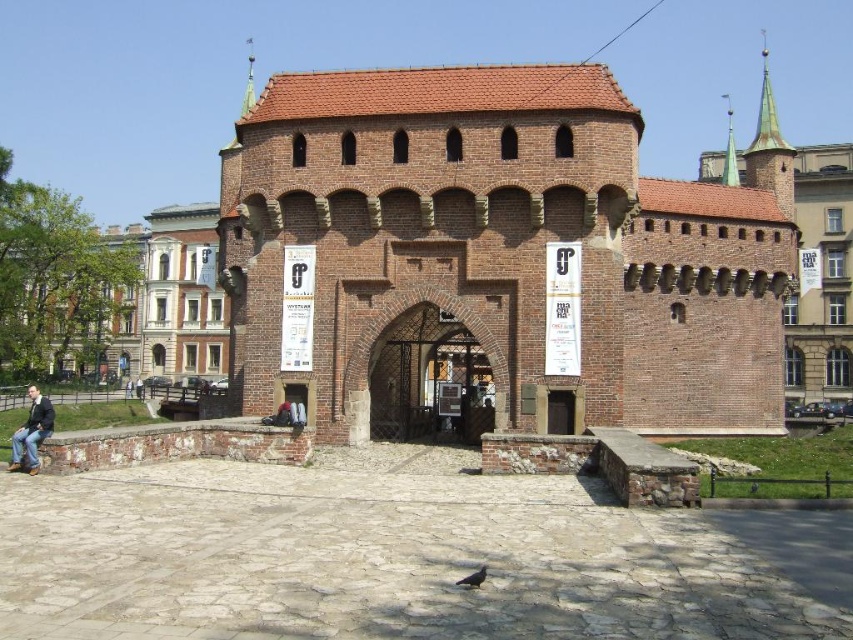
You are a delivery person trying to pass through the open gateway of the historic brick structure. There is a gray matte pigeon at center and dark blue jeans at lower left in your view. Which object is narrower so you can plan your path?

The gray matte pigeon at center has a lesser width compared to dark blue jeans at lower left, so it is narrower. You can plan your path around the gray matte pigeon at center to ensure enough space for your delivery vehicle.

You are standing in front of the historic brick structure and want to take a photo of the brick gate at center and the dark blue jeans at lower left. Which object should you focus on first to ensure both are in the frame without moving the camera?

You should focus on the brick gate at center first because it is closer to the viewer than the dark blue jeans at lower left, so adjusting the focus to the closer object will help keep both in the frame.